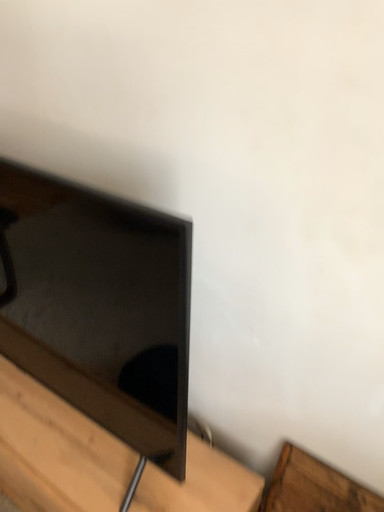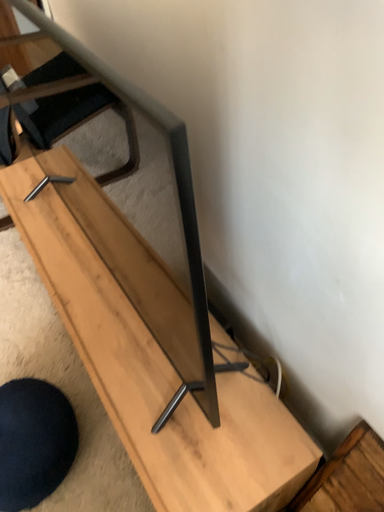
Question: Which way did the camera rotate in the video?

Choices:
 (A) rotated left
 (B) rotated right

Answer: (A)